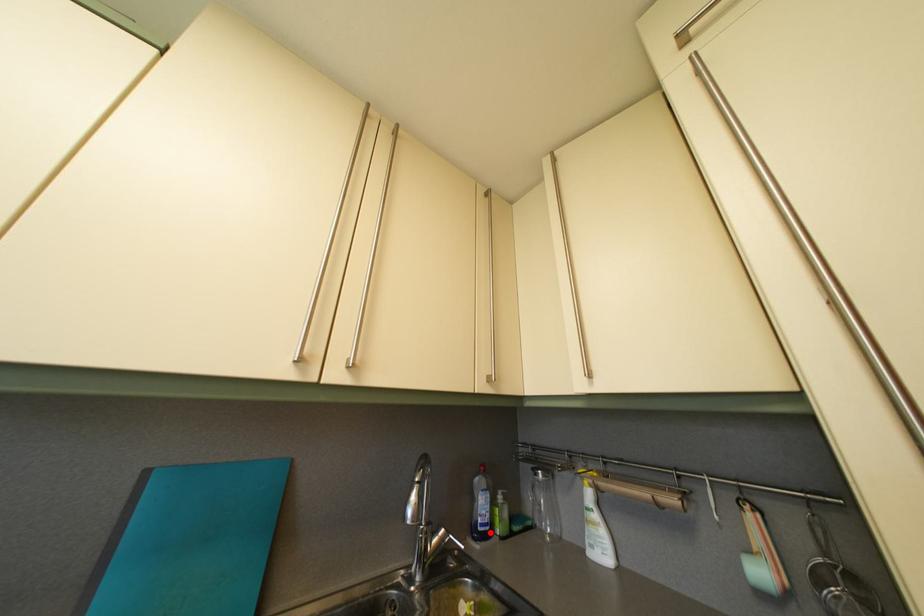
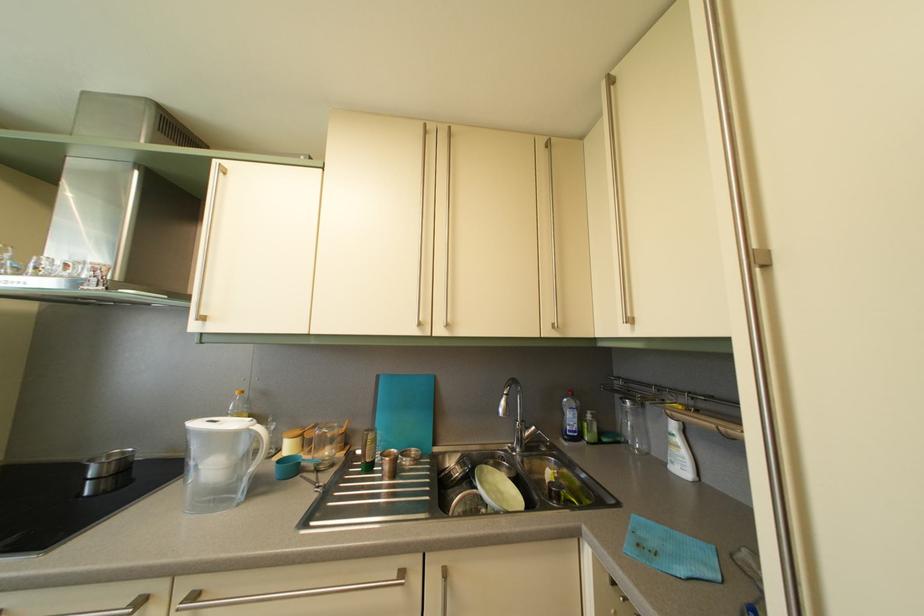
The point at the highlighted location is marked in the first image. Where is the corresponding point in the second image?

(578, 439)